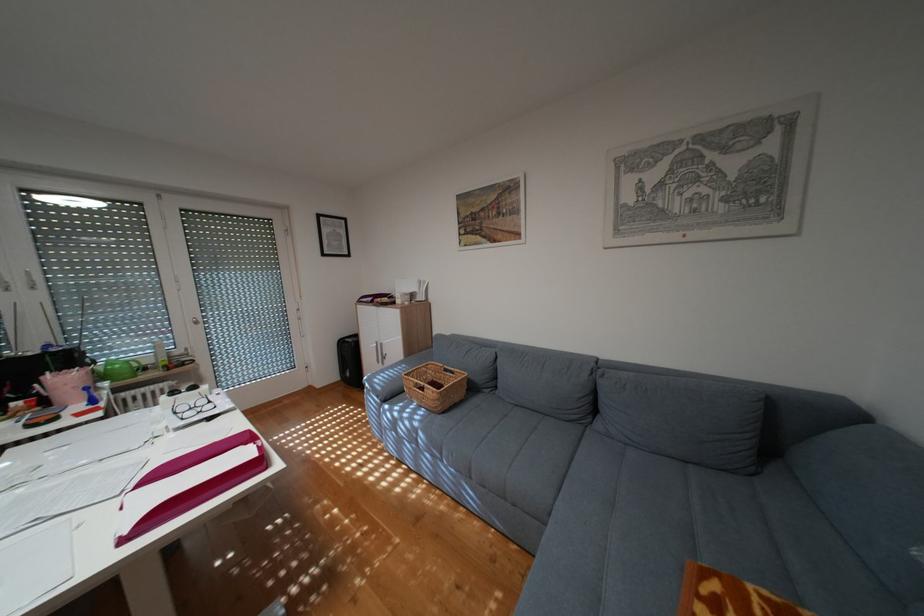
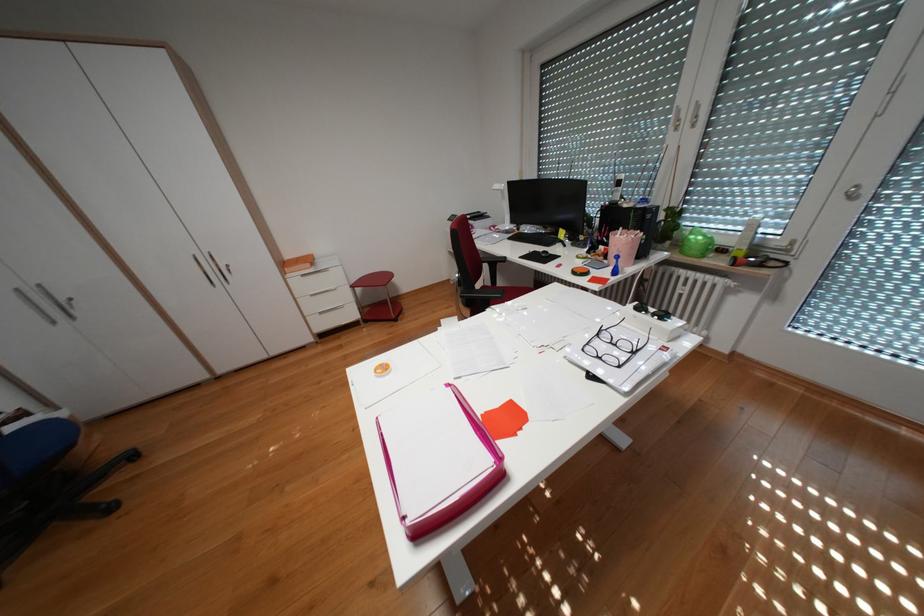
Locate, in the second image, the point that corresponds to the point at 56,402 in the first image.

(618, 254)